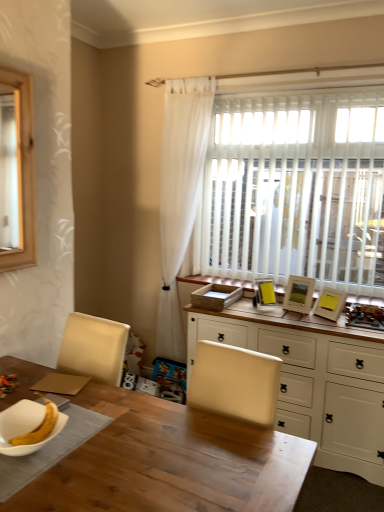
I want to click on free space in front of white glossy bowl at lower left, so [x=42, y=485].